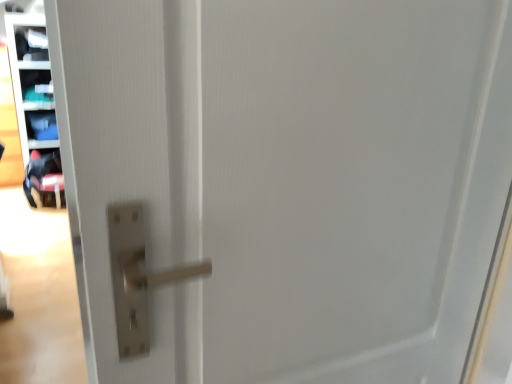
Question: From a real-world perspective, is matte plastic shelf at upper left, the 2th shelf viewed from the top, under matte plastic shelf at upper left, the third shelf when ordered from top to bottom?

Choices:
 (A) no
 (B) yes

Answer: (A)

Question: Does matte plastic shelf at upper left, the 2th shelf viewed from the top, have a larger size compared to matte plastic shelf at upper left, which is the 2th shelf in bottom-to-top order?

Choices:
 (A) yes
 (B) no

Answer: (B)

Question: Is matte plastic shelf at upper left, which ranks as the 3th shelf in bottom-to-top order, at the left side of matte plastic shelf at upper left, which is the 2th shelf in bottom-to-top order?

Choices:
 (A) yes
 (B) no

Answer: (B)

Question: Is matte plastic shelf at upper left, the 2th shelf viewed from the top, closer to camera compared to matte plastic shelf at upper left, which is the 2th shelf in bottom-to-top order?

Choices:
 (A) no
 (B) yes

Answer: (A)

Question: Is matte plastic shelf at upper left, the 2th shelf viewed from the top, facing towards matte plastic shelf at upper left, which is the 2th shelf in bottom-to-top order?

Choices:
 (A) no
 (B) yes

Answer: (B)

Question: Is matte plastic shelf at upper left, which ranks as the 3th shelf in bottom-to-top order, at the right side of matte plastic shelf at upper left, the third shelf when ordered from top to bottom?

Choices:
 (A) no
 (B) yes

Answer: (B)

Question: Is matte plastic shelf at upper left, the third shelf when ordered from top to bottom, positioned beyond the bounds of matte plastic shelf at left, placed as the fourth shelf when sorted from top to bottom?

Choices:
 (A) no
 (B) yes

Answer: (B)

Question: From the image's perspective, is matte plastic shelf at upper left, which is the 2th shelf in bottom-to-top order, located beneath matte plastic shelf at left, placed as the fourth shelf when sorted from top to bottom?

Choices:
 (A) yes
 (B) no

Answer: (B)

Question: Is matte plastic shelf at upper left, which is the 2th shelf in bottom-to-top order, at the right side of matte plastic shelf at left, arranged as the first shelf when ordered from the bottom?

Choices:
 (A) no
 (B) yes

Answer: (A)

Question: Is matte plastic shelf at upper left, the third shelf when ordered from top to bottom, facing towards matte plastic shelf at left, placed as the fourth shelf when sorted from top to bottom?

Choices:
 (A) yes
 (B) no

Answer: (A)

Question: Is the position of matte plastic shelf at upper left, the third shelf when ordered from top to bottom, more distant than that of matte plastic shelf at left, placed as the fourth shelf when sorted from top to bottom?

Choices:
 (A) no
 (B) yes

Answer: (A)

Question: Considering the relative sizes of matte plastic shelf at upper left, the third shelf when ordered from top to bottom, and matte plastic shelf at left, placed as the fourth shelf when sorted from top to bottom, in the image provided, is matte plastic shelf at upper left, the third shelf when ordered from top to bottom, smaller than matte plastic shelf at left, placed as the fourth shelf when sorted from top to bottom,?

Choices:
 (A) yes
 (B) no

Answer: (B)

Question: Is matte plastic shelf at upper left, which ranks as the 3th shelf in bottom-to-top order, thinner than matte plastic shelf at upper left, the first shelf positioned from the top?

Choices:
 (A) yes
 (B) no

Answer: (B)